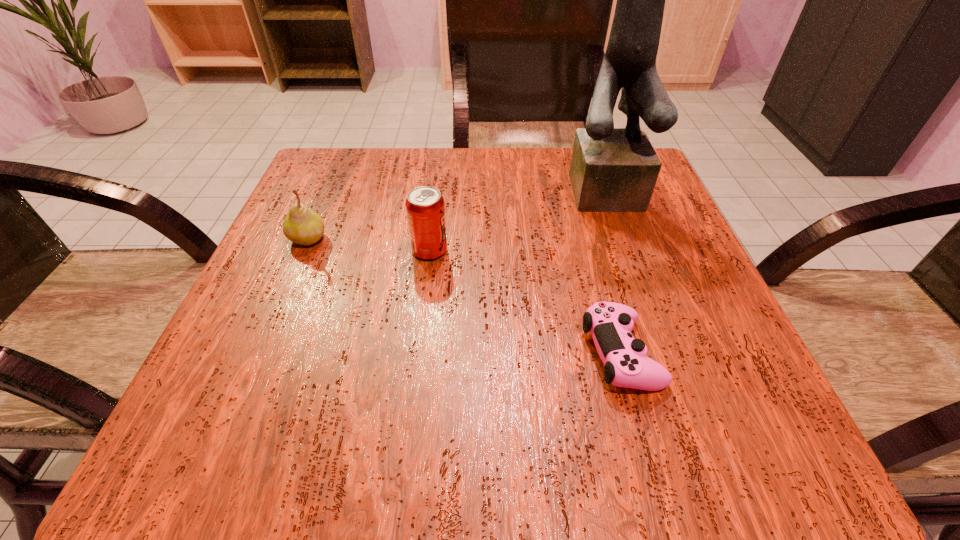
Find the location of a particular element. object at the far edge is located at coordinates (612, 170).

Locate an element on the screen. object positioned at the left edge is located at coordinates (301, 225).

At what (x,y) coordinates should I click in order to perform the action: click on sculpture situated at the right edge. Please return your answer as a coordinate pair (x, y). Looking at the image, I should click on (612, 170).

Locate an element on the screen. This screenshot has width=960, height=540. control positioned at the right edge is located at coordinates (610, 324).

Identify the location of object at the far right corner. The image size is (960, 540). (612, 170).

The height and width of the screenshot is (540, 960). Find the location of `vacant space at the far edge of the desktop`. vacant space at the far edge of the desktop is located at coordinates (542, 164).

In the image, there is a desktop. At what (x,y) coordinates should I click in order to perform the action: click on free space at the near edge. Please return your answer as a coordinate pair (x, y). The width and height of the screenshot is (960, 540). Looking at the image, I should click on (471, 450).

Find the location of `blank space at the left edge`. blank space at the left edge is located at coordinates (334, 330).

Locate an element on the screen. free spot at the right edge of the desktop is located at coordinates (722, 370).

Locate an element on the screen. This screenshot has width=960, height=540. vacant space at the far left corner of the desktop is located at coordinates (348, 186).